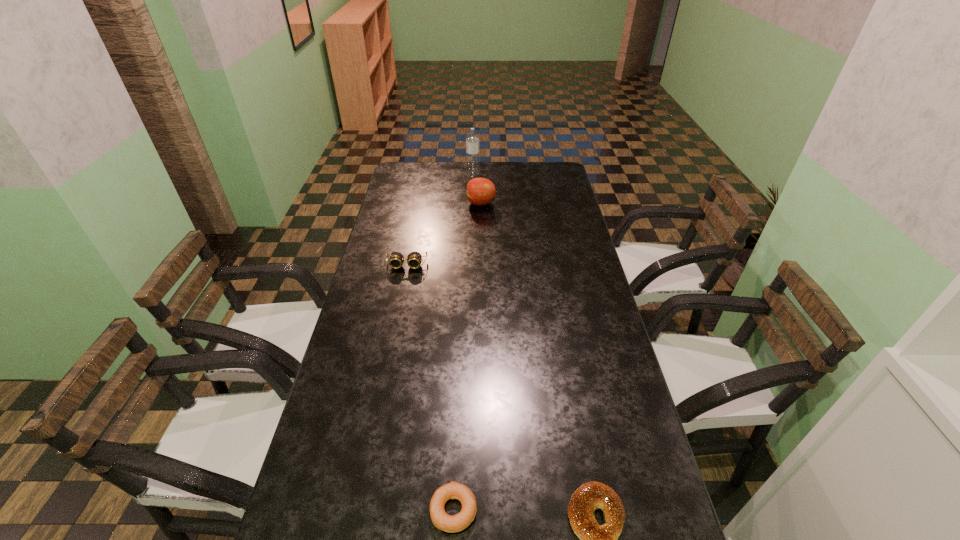
This screenshot has width=960, height=540. What are the coordinates of `free space between the left bagel and the water bottle` in the screenshot? It's located at (464, 342).

Locate an element on the screen. This screenshot has height=540, width=960. blank region between the apple and the goggles is located at coordinates (444, 234).

Identify which object is the second closest to the tallest object. Please provide its 2D coordinates. Your answer should be formatted as a tuple, i.e. [(x, y)], where the tuple contains the x and y coordinates of a point satisfying the conditions above.

[(414, 259)]

The width and height of the screenshot is (960, 540). In order to click on object that stands as the fourth closest to the leftmost object in this screenshot , I will do `click(594, 539)`.

Locate an element on the screen. This screenshot has height=540, width=960. blank space that satisfies the following two spatial constraints: 1. through the lenses of the third shortest object; 2. on the right side of the left bagel is located at coordinates (358, 510).

This screenshot has height=540, width=960. Identify the location of vacant space that satisfies the following two spatial constraints: 1. on the back side of the water bottle; 2. on the right side of the left bagel. (468, 176).